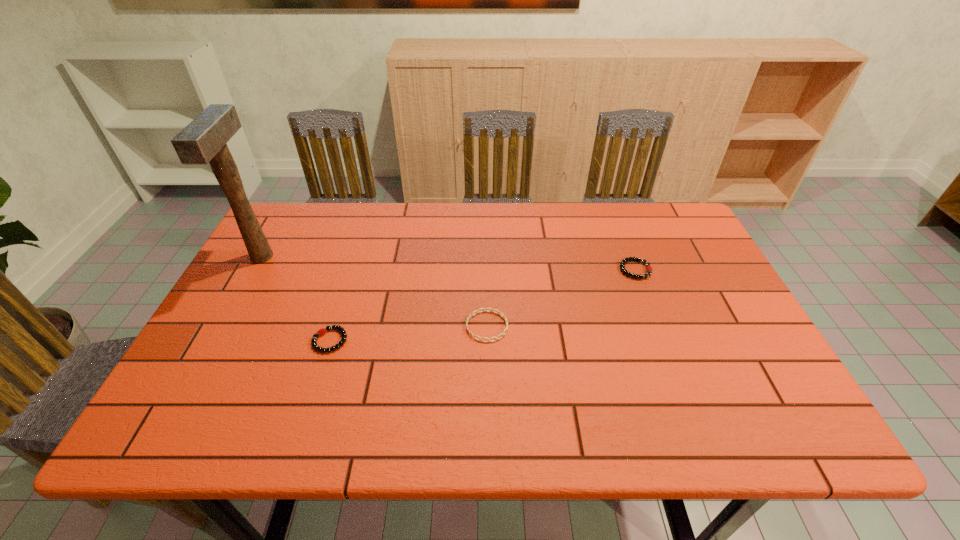
The height and width of the screenshot is (540, 960). Find the location of `free point between the rightmost bracelet and the third object from left to right`. free point between the rightmost bracelet and the third object from left to right is located at coordinates (562, 298).

Locate an element on the screen. The image size is (960, 540). unoccupied position between the third object from right to left and the farthest bracelet is located at coordinates (483, 305).

Identify the location of vacant region between the second object from left to right and the rightmost object. The width and height of the screenshot is (960, 540). (483, 305).

Find the location of a particular element. free space between the rightmost bracelet and the second bracelet from left to right is located at coordinates (562, 298).

The height and width of the screenshot is (540, 960). Identify the location of free space that is in between the second bracelet from right to left and the farthest bracelet. (562, 298).

I want to click on vacant space in between the leftmost bracelet and the second bracelet from right to left, so click(x=409, y=333).

Image resolution: width=960 pixels, height=540 pixels. Find the location of `free space that is in between the rightmost object and the third object from left to right`. free space that is in between the rightmost object and the third object from left to right is located at coordinates (562, 298).

Locate an element on the screen. Image resolution: width=960 pixels, height=540 pixels. vacant point located between the second bracelet from right to left and the rightmost object is located at coordinates (562, 298).

This screenshot has height=540, width=960. What are the coordinates of `free space between the second bracelet from left to right and the leftmost bracelet` in the screenshot? It's located at (409, 333).

Locate which object ranks third in proximity to the second bracelet from left to right. Please provide its 2D coordinates. Your answer should be formatted as a tuple, i.e. [(x, y)], where the tuple contains the x and y coordinates of a point satisfying the conditions above.

[(203, 140)]